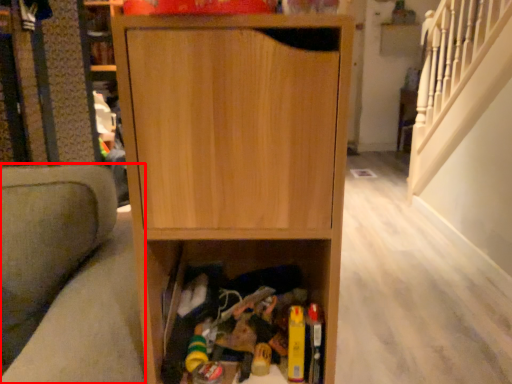
Question: Observing the image, what is the correct spatial positioning of armchair (annotated by the red box) in reference to cabinetry?

Choices:
 (A) right
 (B) left

Answer: (B)